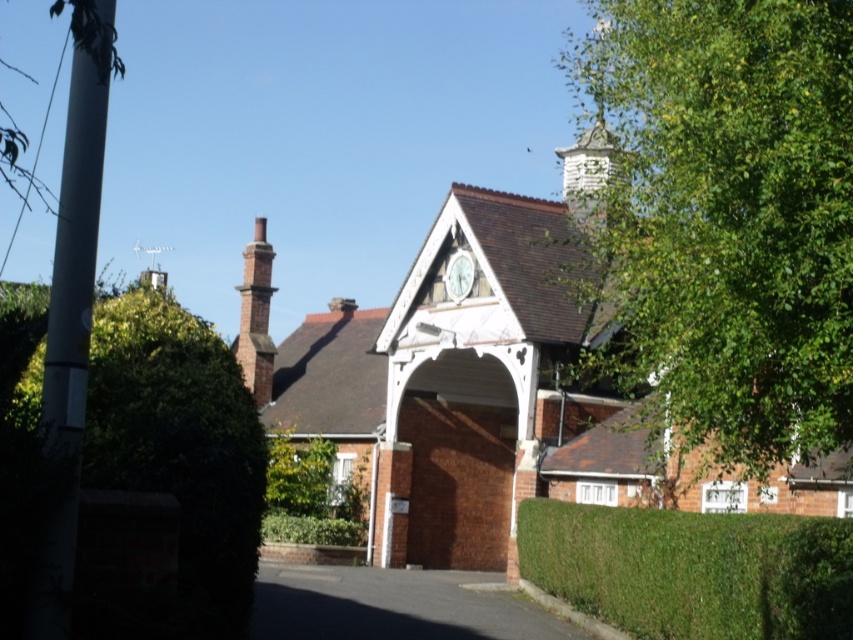
You are a landscape architect designing a garden layout. You need to place a new statue between the green leafy tree at upper right and the green leafy tree at left. Which tree should the statue be closer to if you want it to balance the visual weight of the two trees?

The statue should be closer to the green leafy tree at upper right because it occupies less space and thus requires more visual weight to balance the composition.